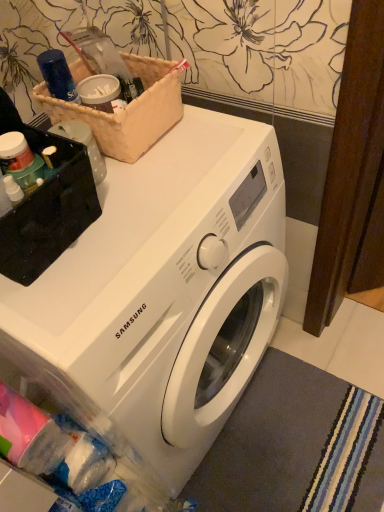
Question: From the image's perspective, is gray soft carpet at lower right located above white glossy washing machine at center?

Choices:
 (A) yes
 (B) no

Answer: (B)

Question: Is gray soft carpet at lower right taller than white glossy washing machine at center?

Choices:
 (A) no
 (B) yes

Answer: (A)

Question: From a real-world perspective, is gray soft carpet at lower right located higher than white glossy washing machine at center?

Choices:
 (A) no
 (B) yes

Answer: (A)

Question: From the image's perspective, is gray soft carpet at lower right below white glossy washing machine at center?

Choices:
 (A) no
 (B) yes

Answer: (B)

Question: Is gray soft carpet at lower right far from white glossy washing machine at center?

Choices:
 (A) yes
 (B) no

Answer: (B)

Question: From a real-world perspective, is white glossy washing machine at center physically located above or below brown woven basket at upper left?

Choices:
 (A) below
 (B) above

Answer: (A)

Question: From the image's perspective, relative to brown woven basket at upper left, is white glossy washing machine at center above or below?

Choices:
 (A) below
 (B) above

Answer: (A)

Question: Is white glossy washing machine at center bigger or smaller than brown woven basket at upper left?

Choices:
 (A) big
 (B) small

Answer: (A)

Question: Does point (221, 415) appear closer or farther from the camera than point (153, 96)?

Choices:
 (A) closer
 (B) farther

Answer: (B)

Question: Which is correct: gray soft carpet at lower right is inside white glossy washing machine at center, or outside of it?

Choices:
 (A) inside
 (B) outside

Answer: (B)

Question: Is point (309, 367) closer or farther from the camera than point (190, 461)?

Choices:
 (A) farther
 (B) closer

Answer: (A)

Question: From their relative heights in the image, would you say gray soft carpet at lower right is taller or shorter than white glossy washing machine at center?

Choices:
 (A) tall
 (B) short

Answer: (B)

Question: Relative to white glossy washing machine at center, is gray soft carpet at lower right in front or behind?

Choices:
 (A) front
 (B) behind

Answer: (B)

Question: From a real-world perspective, is brown woven basket at upper left above or below white glossy washing machine at center?

Choices:
 (A) above
 (B) below

Answer: (A)

Question: Looking at the image, does brown woven basket at upper left seem bigger or smaller compared to white glossy washing machine at center?

Choices:
 (A) small
 (B) big

Answer: (A)